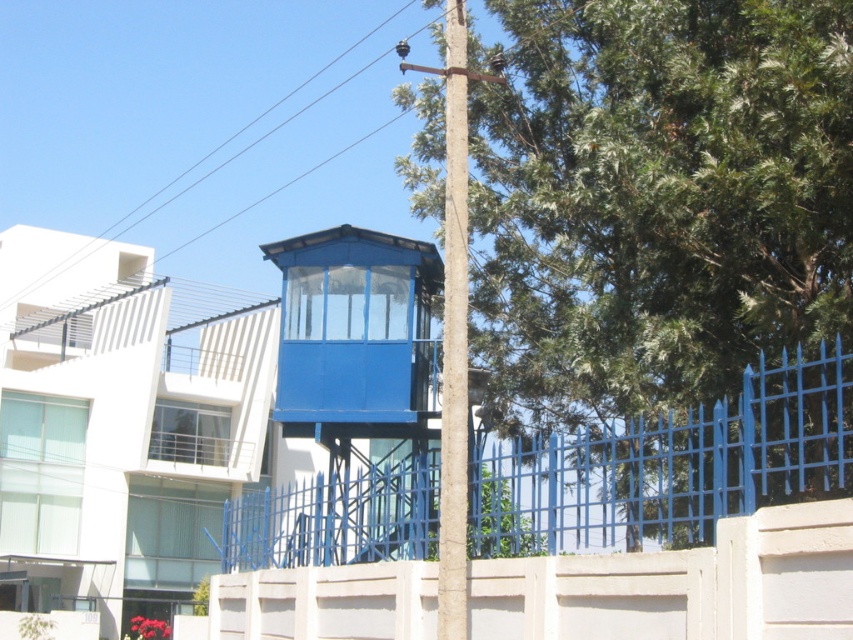
Question: Considering the real-world distances, which object is closest to the green leafy tree at center?

Choices:
 (A) metallic blue fence at center
 (B) smooth wire at upper center
 (C) brown textured pole at center

Answer: (A)

Question: Among these objects, which one is farthest from the camera?

Choices:
 (A) brown textured pole at center
 (B) green leafy tree at center
 (C) smooth wire at upper center
 (D) metallic blue fence at center

Answer: (C)

Question: Among these objects, which one is nearest to the camera?

Choices:
 (A) smooth wire at upper center
 (B) green leafy tree at center

Answer: (B)

Question: Does green leafy tree at center appear on the left side of brown textured pole at center?

Choices:
 (A) no
 (B) yes

Answer: (A)

Question: Observing the image, what is the correct spatial positioning of smooth wire at upper center in reference to metallic blue fence at center?

Choices:
 (A) right
 (B) left

Answer: (B)

Question: Is green leafy tree at center thinner than metallic blue fence at center?

Choices:
 (A) no
 (B) yes

Answer: (B)